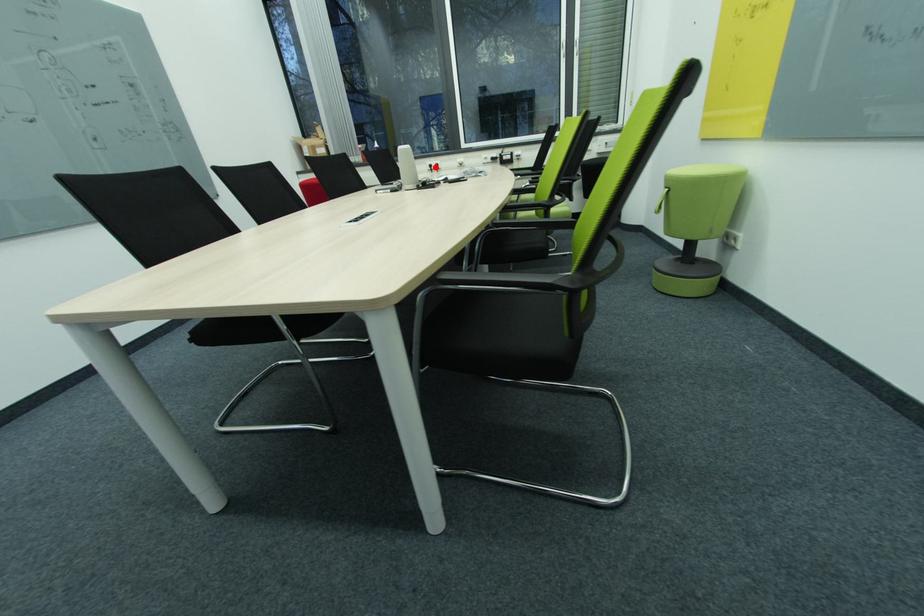
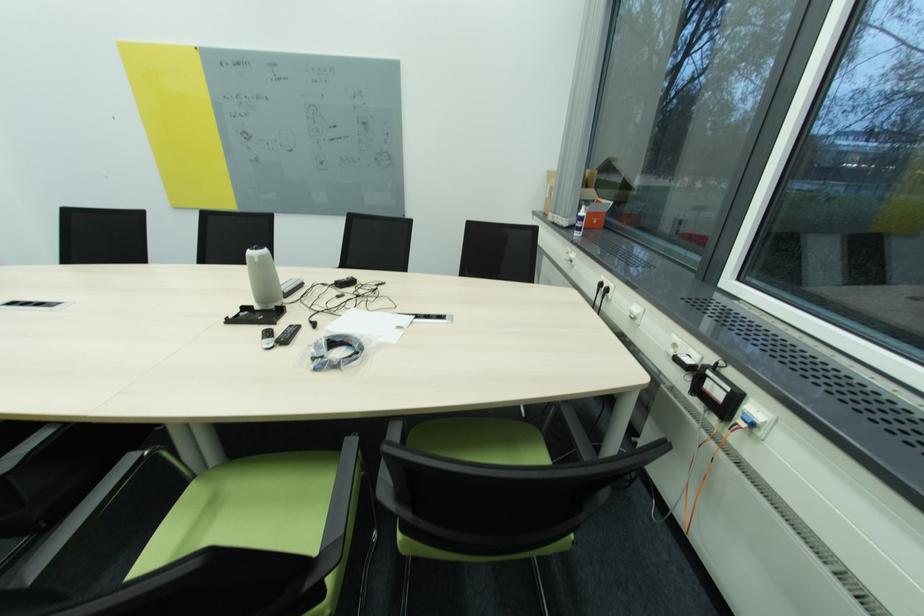
Question: I am providing you with two images of the same scene from different viewpoints. A red point is marked on the first image. Is the red point's position out of view in image 2?

Choices:
 (A) Yes
 (B) No

Answer: (B)